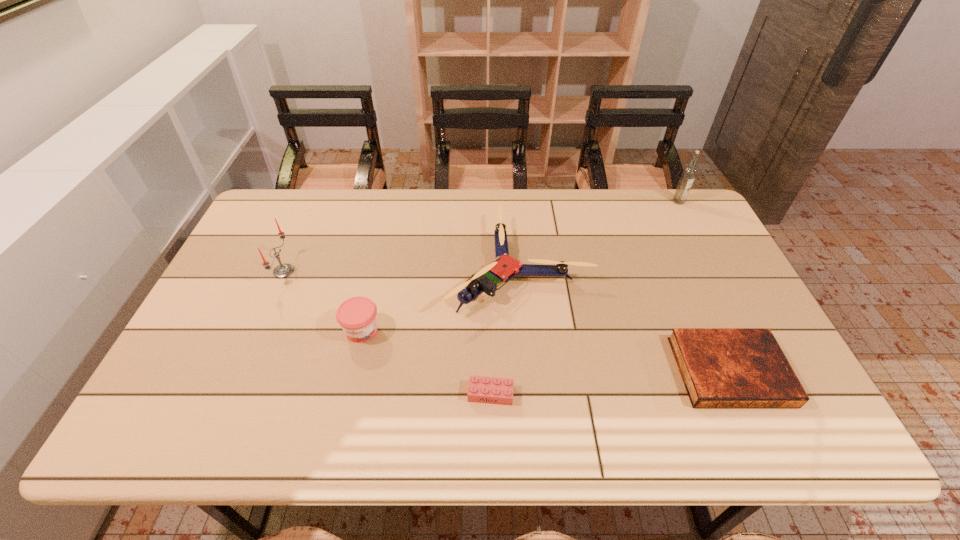
Where is `free region that satisfies the following two spatial constraints: 1. on the front-facing side of the second tallest object; 2. on the back side of the Lego`? free region that satisfies the following two spatial constraints: 1. on the front-facing side of the second tallest object; 2. on the back side of the Lego is located at coordinates (230, 394).

This screenshot has width=960, height=540. What are the coordinates of `free space that satisfies the following two spatial constraints: 1. on the front-facing side of the leftmost object; 2. on the left side of the Lego` in the screenshot? It's located at (230, 394).

Find the location of a particular element. The width and height of the screenshot is (960, 540). vacant area in the image that satisfies the following two spatial constraints: 1. on the front-facing side of the candle; 2. on the right side of the Lego is located at coordinates (230, 394).

Identify the location of vacant space that satisfies the following two spatial constraints: 1. on the front label of the Lego; 2. on the left side of the jam. (348, 394).